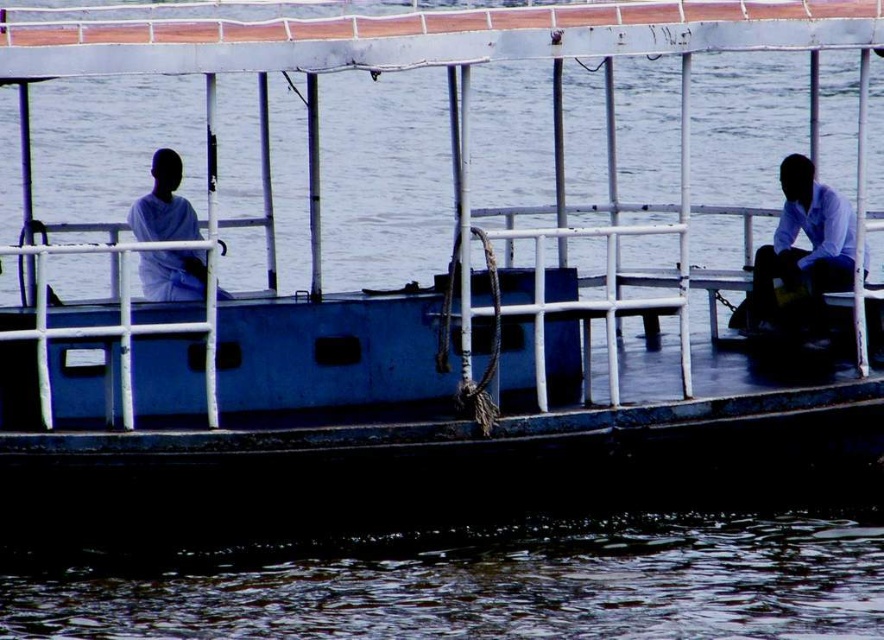
Question: Is white matte shirt at right bigger than white matte shirt at left?

Choices:
 (A) no
 (B) yes

Answer: (B)

Question: Which of these objects is positioned closest to the white matte shirt at left?

Choices:
 (A) dark water at lower center
 (B) white matte shirt at right

Answer: (A)

Question: Is dark water at lower center positioned behind white matte shirt at left?

Choices:
 (A) no
 (B) yes

Answer: (A)

Question: Which object is positioned farthest from the white matte shirt at left?

Choices:
 (A) dark water at lower center
 (B) white matte shirt at right

Answer: (B)

Question: Is dark water at lower center to the right of white matte shirt at left from the viewer's perspective?

Choices:
 (A) no
 (B) yes

Answer: (B)

Question: Which point is closer to the camera taking this photo?

Choices:
 (A) (164, 148)
 (B) (841, 266)

Answer: (B)